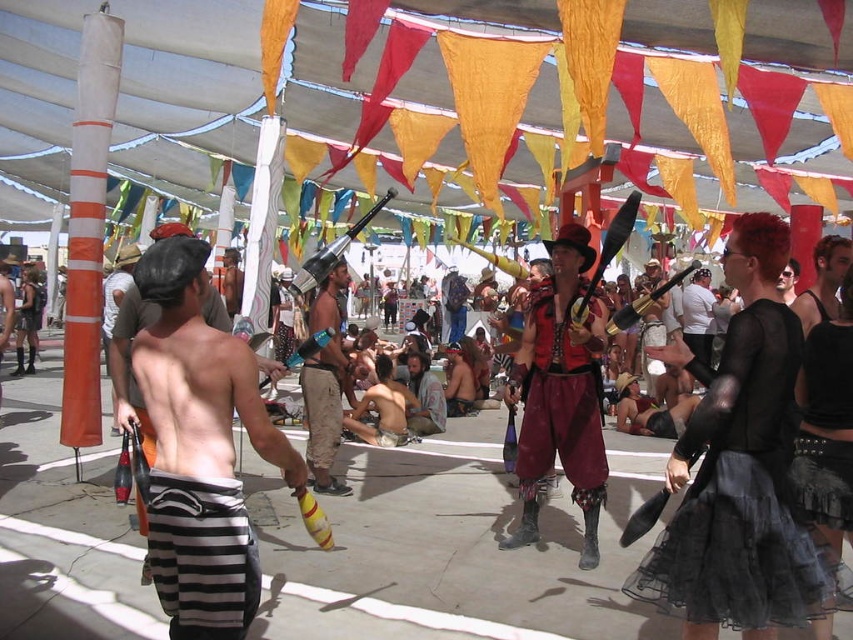
Which is below, black sheer top at center or black leather jacket at center?

black sheer top at center

Consider the image. Does black sheer top at center appear over black leather jacket at center?

Incorrect, black sheer top at center is not positioned above black leather jacket at center.

Where is `black sheer top at center`? Image resolution: width=853 pixels, height=640 pixels. black sheer top at center is located at coordinates (737, 468).

Where is `black sheer top at center`? black sheer top at center is located at coordinates (737, 468).

Based on the photo, does striped fabric shorts at lower left have a lesser width compared to shiny black leather jacket at center?

Indeed, striped fabric shorts at lower left has a lesser width compared to shiny black leather jacket at center.

Is striped fabric shorts at lower left bigger than shiny black leather jacket at center?

Yes.

Identify the location of striped fabric shorts at lower left. (28, 307).

Where is `striped fabric shorts at lower left`? This screenshot has height=640, width=853. striped fabric shorts at lower left is located at coordinates (28, 307).

Which is above, striped fabric shorts at center or shiny black leather jacket at center?

shiny black leather jacket at center is above.

Does striped fabric shorts at center appear on the left side of shiny black leather jacket at center?

Yes, striped fabric shorts at center is to the left of shiny black leather jacket at center.

Is point (218, 618) more distant than point (780, 284)?

That is False.

Locate an element on the screen. This screenshot has width=853, height=640. striped fabric shorts at center is located at coordinates (199, 449).